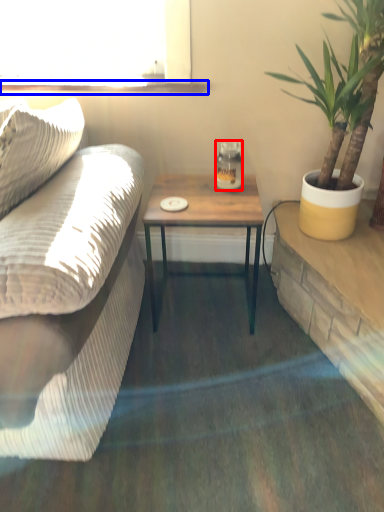
Question: Among these objects, which one is nearest to the camera, coffee cup (highlighted by a red box) or window sill (highlighted by a blue box)?

Choices:
 (A) coffee cup
 (B) window sill

Answer: (A)